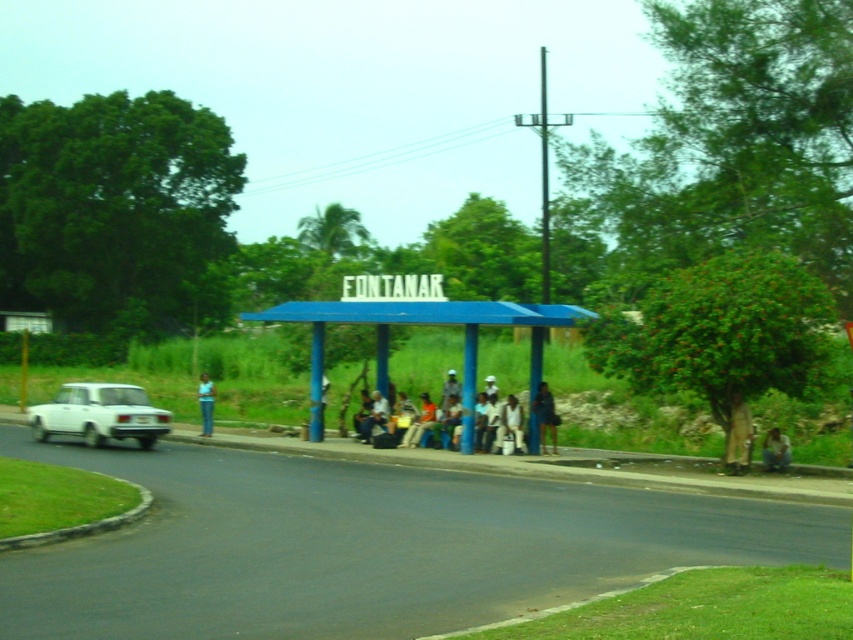
Can you confirm if white matte car at left is positioned to the left of blue jeans at left?

In fact, white matte car at left is to the right of blue jeans at left.

Which is behind, point (138, 387) or point (202, 416)?

Positioned behind is point (138, 387).

Locate an element on the screen. The image size is (853, 640). white matte car at left is located at coordinates (99, 413).

Which is in front, point (543, 452) or point (521, 428)?

Point (521, 428) is more forward.

Is point (550, 435) more distant than point (517, 420)?

Yes, point (550, 435) is farther from viewer.

The width and height of the screenshot is (853, 640). What are the coordinates of `dark blue fabric dress at center` in the screenshot? It's located at (544, 417).

Looking at this image, does blue painted metal bus stop at center appear on the right side of matte blue bench at center?

Indeed, blue painted metal bus stop at center is positioned on the right side of matte blue bench at center.

Does blue painted metal bus stop at center have a lesser height compared to matte blue bench at center?

Incorrect, blue painted metal bus stop at center's height does not fall short of matte blue bench at center's.

Locate an element on the screen. Image resolution: width=853 pixels, height=640 pixels. blue painted metal bus stop at center is located at coordinates (416, 324).